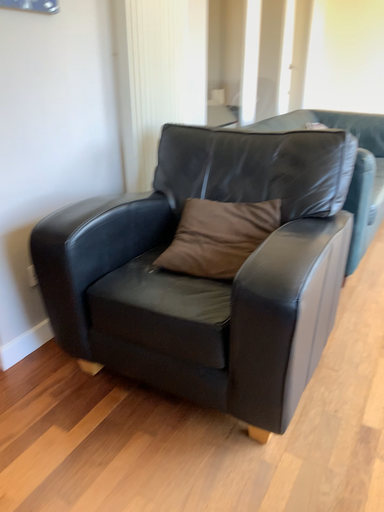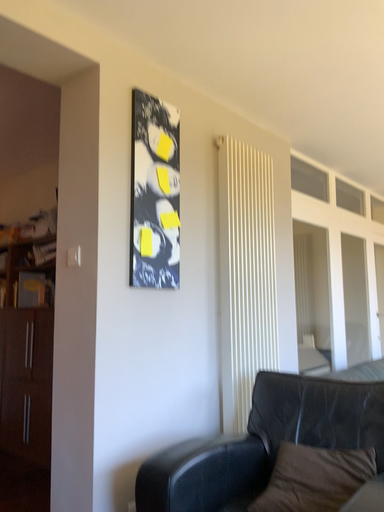
Question: How did the camera likely rotate when shooting the video?

Choices:
 (A) rotated upward
 (B) rotated downward

Answer: (A)